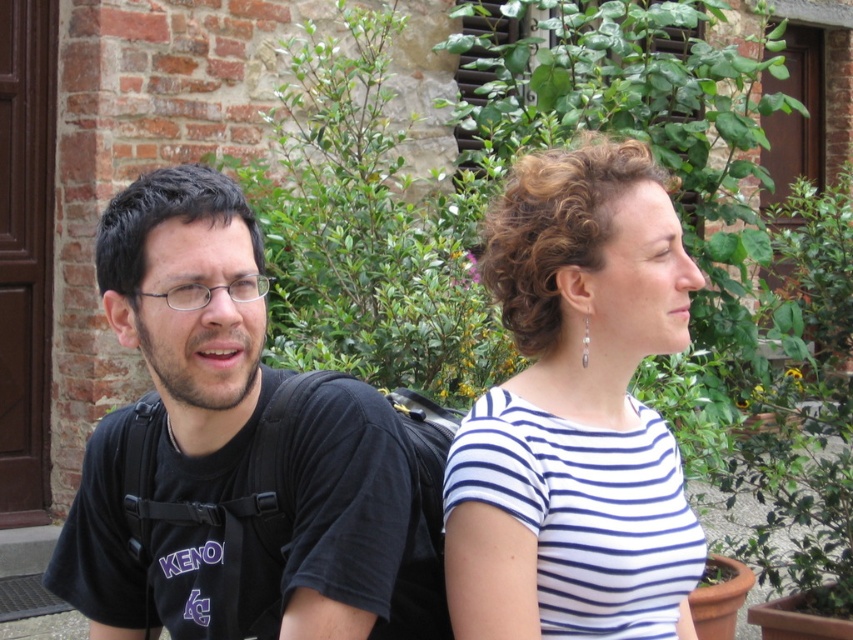
Does point (548, 612) come closer to viewer compared to point (326, 420)?

No, it is behind (326, 420).

Which is in front, point (495, 396) or point (235, 556)?

Point (235, 556) is more forward.

The width and height of the screenshot is (853, 640). I want to click on white striped shirt at center, so click(x=576, y=413).